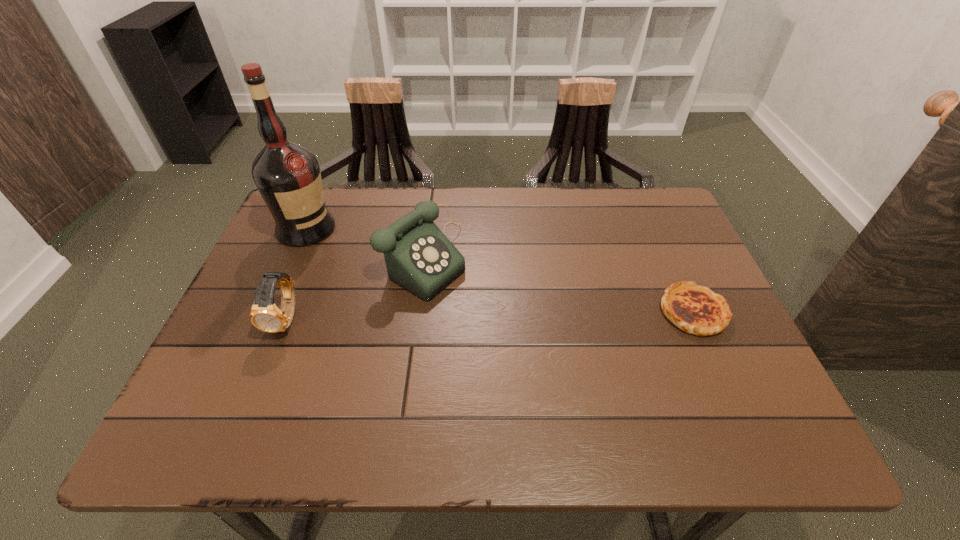
Where is `vacant spot on the desktop that is between the second shortest object and the rightmost object and is positioned on the surface of the tallest object`? This screenshot has height=540, width=960. vacant spot on the desktop that is between the second shortest object and the rightmost object and is positioned on the surface of the tallest object is located at coordinates (454, 316).

I want to click on free spot on the desktop that is between the watch and the shortest object and is positioned on the dial of the telephone, so click(521, 315).